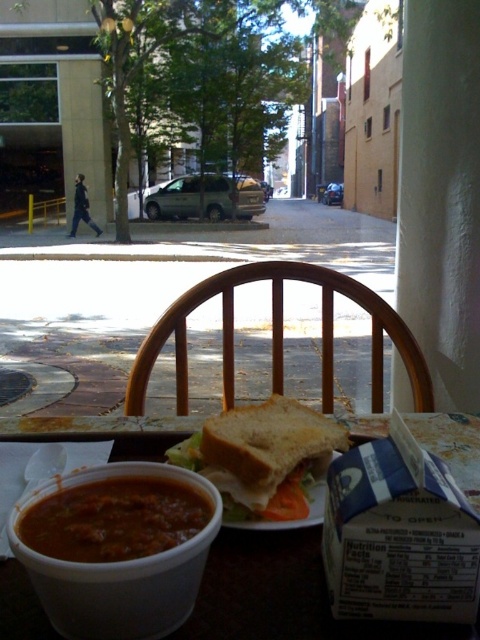
Question: Which object is the closest to the white plastic table at center?

Choices:
 (A) white bread sandwich at center
 (B) thick tomato soup at lower left
 (C) brown matte bowl at lower left

Answer: (A)

Question: Which point is closer to the camera?

Choices:
 (A) white bread sandwich at center
 (B) brown matte bowl at lower left

Answer: (B)

Question: Observing the image, what is the correct spatial positioning of white plastic table at center in reference to thick tomato soup at lower left?

Choices:
 (A) below
 (B) above

Answer: (A)

Question: Is white bread sandwich at center further to camera compared to thick tomato soup at lower left?

Choices:
 (A) no
 (B) yes

Answer: (B)

Question: Where is white plastic table at center located in relation to white bread sandwich at center in the image?

Choices:
 (A) left
 (B) right

Answer: (A)

Question: Which point appears closest to the camera in this image?

Choices:
 (A) (155, 348)
 (B) (309, 413)
 (C) (113, 508)
 (D) (439, 413)

Answer: (C)